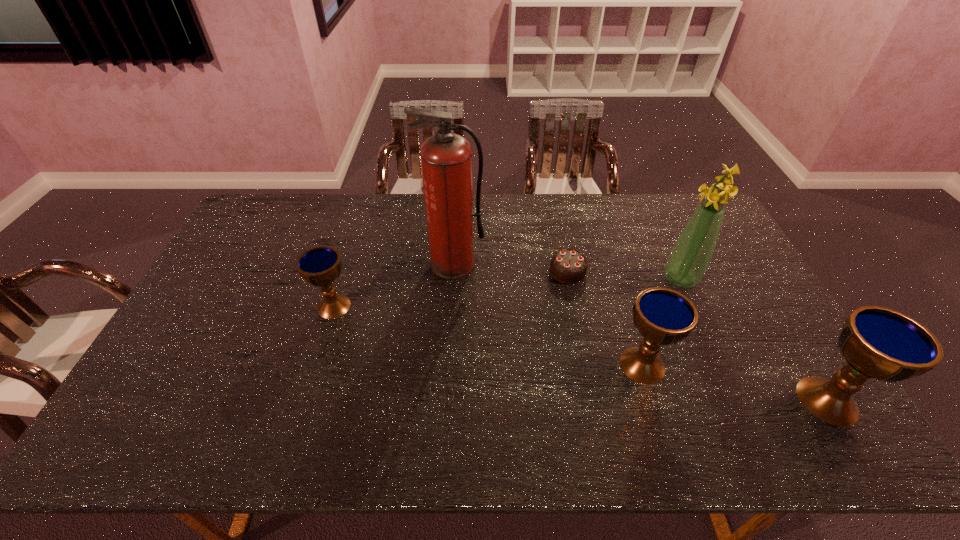
You are a GUI agent. You are given a task and a screenshot of the screen. Output one action in this format:
    pyautogui.click(x=<x>, y=<y>)
    Task: Click on the object that is at the near right corner
    
    Given the screenshot: What is the action you would take?
    pyautogui.click(x=877, y=342)

Where is `vacant region at the far edge of the desktop`? This screenshot has width=960, height=540. vacant region at the far edge of the desktop is located at coordinates (386, 210).

Where is `vacant space at the left edge of the desktop`? This screenshot has height=540, width=960. vacant space at the left edge of the desktop is located at coordinates (211, 279).

The width and height of the screenshot is (960, 540). I want to click on vacant space at the right edge of the desktop, so click(x=712, y=282).

Where is `vacant space at the far left corner`? vacant space at the far left corner is located at coordinates (266, 219).

The image size is (960, 540). Find the location of `vacant area between the rightmost object and the second tallest object`. vacant area between the rightmost object and the second tallest object is located at coordinates (754, 340).

Where is `free space between the second object from left to right and the chocolate cake`? free space between the second object from left to right and the chocolate cake is located at coordinates (511, 268).

Where is `free area in between the rightmost chalice and the leftmost chalice`? The width and height of the screenshot is (960, 540). free area in between the rightmost chalice and the leftmost chalice is located at coordinates (581, 353).

The width and height of the screenshot is (960, 540). In order to click on free spot between the bouquet and the rightmost chalice in this screenshot , I will do `click(754, 340)`.

I want to click on free area in between the fourth object from right to left and the fire extinguisher, so [x=511, y=268].